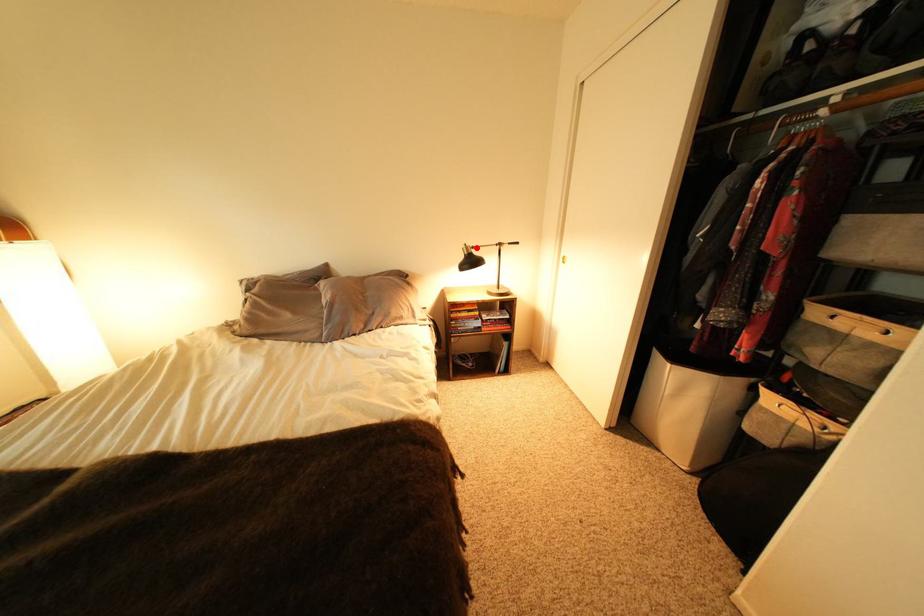
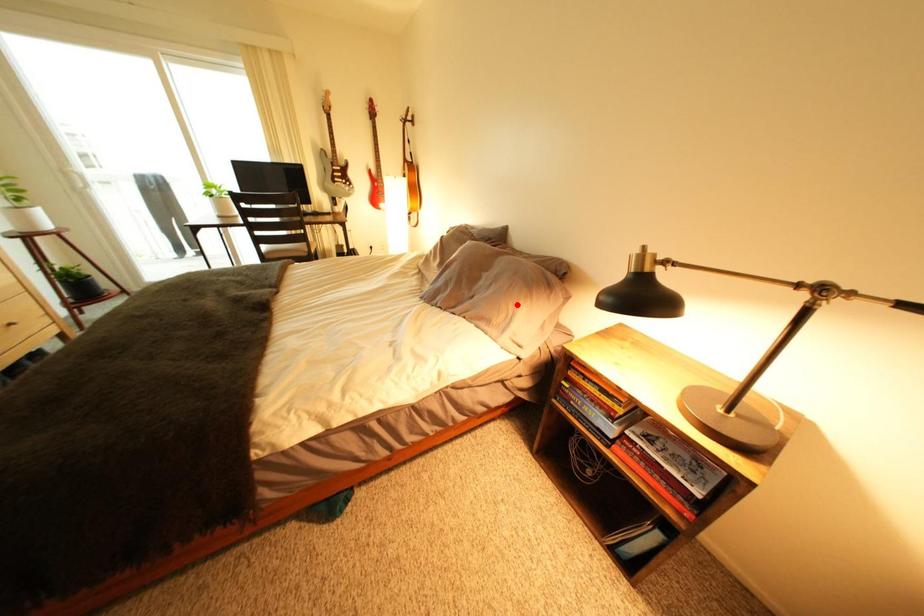
I am providing you with two images of the same scene from different viewpoints. A red point is marked on the first image and another point is marked on the second image. Is the red point in image1 aligned with the point shown in image2?

No